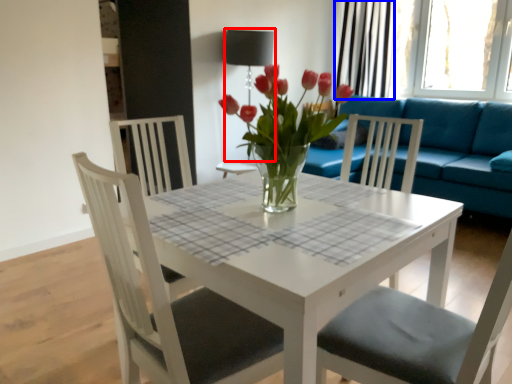
Question: Among these objects, which one is farthest to the camera, lamp (highlighted by a red box) or curtain (highlighted by a blue box)?

Choices:
 (A) lamp
 (B) curtain

Answer: (B)